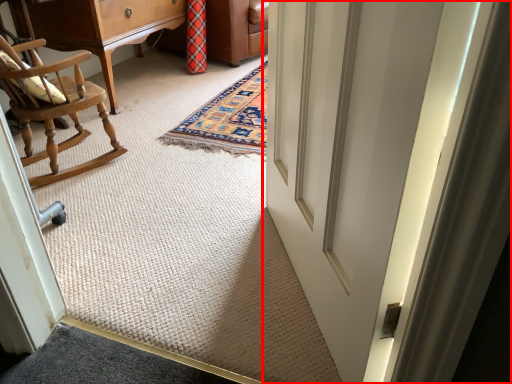
Question: Where is door (annotated by the red box) located in relation to furniture in the image?

Choices:
 (A) left
 (B) right

Answer: (B)